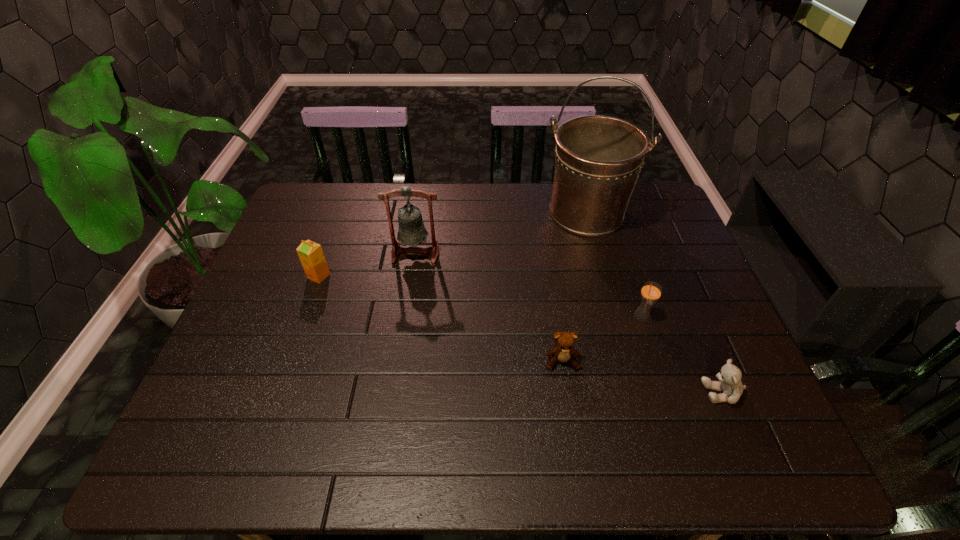
Identify the location of the nearest object. The height and width of the screenshot is (540, 960). (729, 377).

The width and height of the screenshot is (960, 540). I want to click on vacant space located 0.090m on the right of the bucket, so click(659, 213).

Find the location of a particular element. The image size is (960, 540). free space located on the back of the fifth shortest object is located at coordinates (422, 209).

Where is `vacant space located on the back of the third nearest object`? The image size is (960, 540). vacant space located on the back of the third nearest object is located at coordinates (613, 230).

Locate an element on the screen. Image resolution: width=960 pixels, height=540 pixels. vacant space located on the back of the leftmost object is located at coordinates (337, 224).

Locate an element on the screen. Image resolution: width=960 pixels, height=540 pixels. free space located on the front-facing side of the left teddy bear is located at coordinates (570, 416).

The height and width of the screenshot is (540, 960). Find the location of `free location located 0.400m on the face of the nearer teddy bear`. free location located 0.400m on the face of the nearer teddy bear is located at coordinates 522,392.

Where is `free space located 0.130m on the face of the nearer teddy bear`? free space located 0.130m on the face of the nearer teddy bear is located at coordinates (643, 392).

Where is `free space located on the face of the nearer teddy bear`? free space located on the face of the nearer teddy bear is located at coordinates (680, 392).

This screenshot has height=540, width=960. I want to click on object situated at the far edge, so click(x=598, y=159).